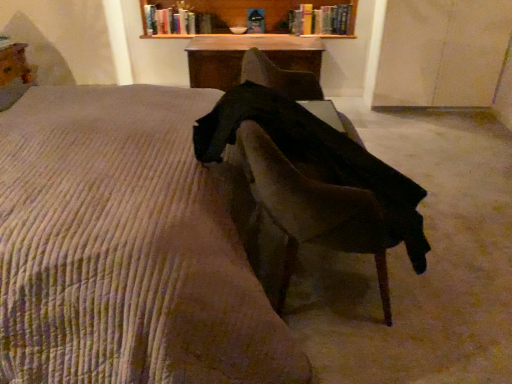
Question: Can you confirm if hardcover book at upper center, which is counted as the first book, starting from the left, is wider than corduroy bedspread at center?

Choices:
 (A) no
 (B) yes

Answer: (A)

Question: Is hardcover book at upper center, which is counted as the first book, starting from the left, positioned with its back to corduroy bedspread at center?

Choices:
 (A) no
 (B) yes

Answer: (A)

Question: From the image's perspective, is hardcover book at upper center, the 2th book viewed from the right, over corduroy bedspread at center?

Choices:
 (A) no
 (B) yes

Answer: (B)

Question: Is hardcover book at upper center, the 2th book viewed from the right, oriented towards corduroy bedspread at center?

Choices:
 (A) no
 (B) yes

Answer: (B)

Question: Is corduroy bedspread at center inside hardcover book at upper center, the 2th book viewed from the right?

Choices:
 (A) yes
 (B) no

Answer: (B)

Question: From a real-world perspective, is hardcover book at upper center, which is counted as the first book, starting from the left, over corduroy bedspread at center?

Choices:
 (A) no
 (B) yes

Answer: (B)

Question: Considering the relative sizes of hardcover book at upper center, which is counted as the first book, starting from the left, and wooden table at upper center, which is counted as the first table, starting from the front, in the image provided, is hardcover book at upper center, which is counted as the first book, starting from the left, smaller than wooden table at upper center, which is counted as the first table, starting from the front,?

Choices:
 (A) yes
 (B) no

Answer: (A)

Question: From the image's perspective, is hardcover book at upper center, which is counted as the first book, starting from the left, under wooden table at upper center, which is the second table from right to left?

Choices:
 (A) no
 (B) yes

Answer: (A)

Question: Considering the relative sizes of hardcover book at upper center, which is counted as the first book, starting from the left, and wooden table at upper center, positioned as the 2th table in back-to-front order, in the image provided, is hardcover book at upper center, which is counted as the first book, starting from the left, wider than wooden table at upper center, positioned as the 2th table in back-to-front order,?

Choices:
 (A) yes
 (B) no

Answer: (B)

Question: Is wooden table at upper center, positioned as the 2th table in back-to-front order, surrounded by hardcover book at upper center, which is counted as the first book, starting from the left?

Choices:
 (A) no
 (B) yes

Answer: (A)

Question: Is hardcover book at upper center, the 2th book viewed from the right, next to wooden table at upper center, the 1th table when ordered from left to right?

Choices:
 (A) no
 (B) yes

Answer: (A)

Question: Does hardcover book at upper center, which is counted as the first book, starting from the left, have a lesser height compared to wooden table at upper center, the 1th table when ordered from left to right?

Choices:
 (A) yes
 (B) no

Answer: (A)

Question: Considering the relative positions of dark fabric chair at center and wooden table at center, which ranks as the second table in left-to-right order, in the image provided, is dark fabric chair at center to the right of wooden table at center, which ranks as the second table in left-to-right order, from the viewer's perspective?

Choices:
 (A) no
 (B) yes

Answer: (B)